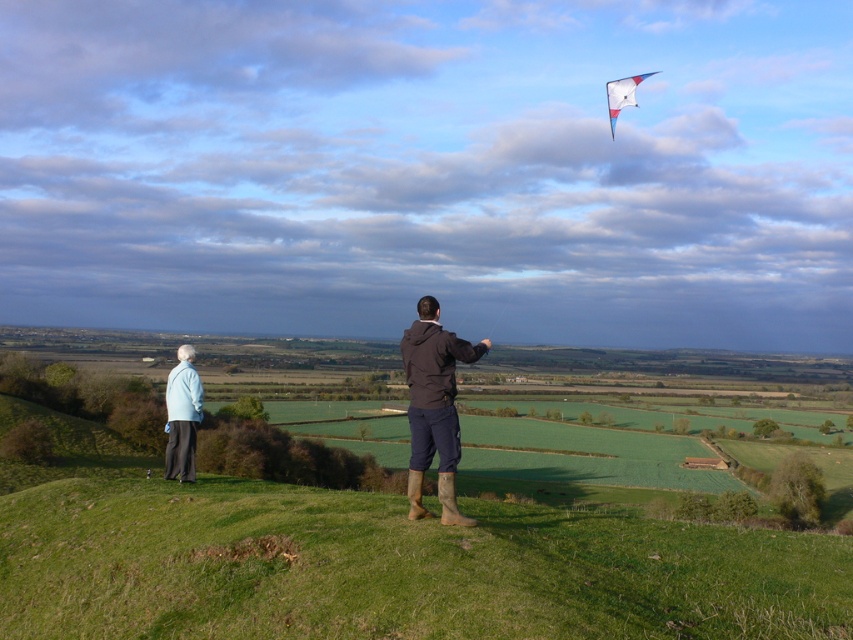
Question: Which of the following is the closest to the observer?

Choices:
 (A) light blue fabric jacket at lower left
 (B) green grassy hillside at center
 (C) brown suede boots at lower center
 (D) white glossy kite at upper right

Answer: (B)

Question: Estimate the real-world distances between objects in this image. Which object is closer to the brown suede boots at lower center?

Choices:
 (A) white glossy kite at upper right
 (B) light blue fabric jacket at lower left

Answer: (B)

Question: Does brown suede boots at lower center come in front of white glossy kite at upper right?

Choices:
 (A) no
 (B) yes

Answer: (B)

Question: Does green grassy hillside at center lie in front of brown suede boots at lower center?

Choices:
 (A) yes
 (B) no

Answer: (A)

Question: Among these objects, which one is farthest from the camera?

Choices:
 (A) white glossy kite at upper right
 (B) light blue fabric jacket at lower left
 (C) green grassy hillside at center

Answer: (A)

Question: In this image, where is brown suede boots at lower center located relative to light blue fabric jacket at lower left?

Choices:
 (A) below
 (B) above

Answer: (B)